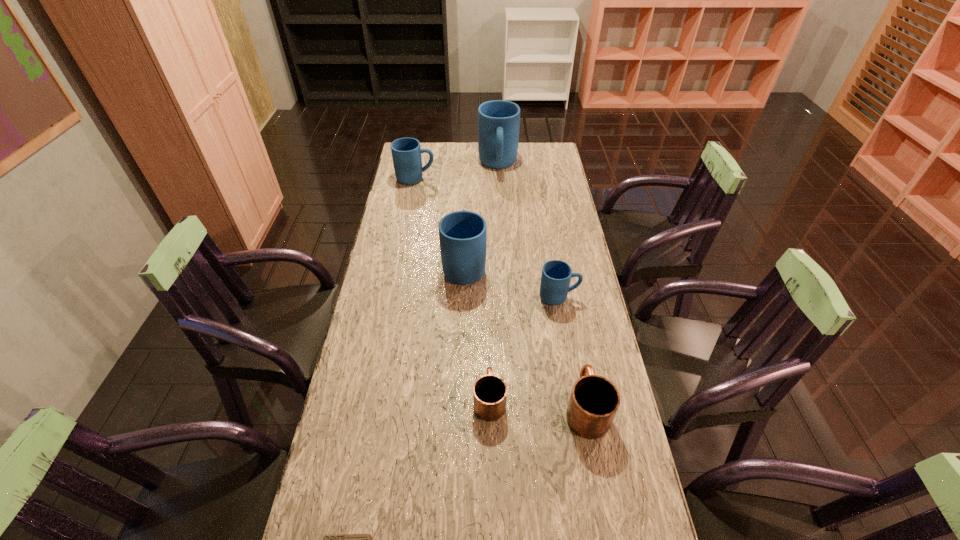
This screenshot has height=540, width=960. Find the location of `free point located 0.240m on the side of the left rust mug with the handle`. free point located 0.240m on the side of the left rust mug with the handle is located at coordinates (488, 314).

Locate an element on the screen. Image resolution: width=960 pixels, height=540 pixels. vacant region located 0.100m on the side of the left rust mug with the handle is located at coordinates (489, 349).

Find the location of `object located in the far edge section of the desktop`. object located in the far edge section of the desktop is located at coordinates coord(498,121).

The width and height of the screenshot is (960, 540). I want to click on object located in the left edge section of the desktop, so click(406, 152).

What are the coordinates of `free space at the far edge of the desktop` in the screenshot? It's located at (463, 144).

You are a GUI agent. You are given a task and a screenshot of the screen. Output one action in this format:
    pyautogui.click(x=<x>, y=<y>)
    Task: Click on the blank space at the left edge
    This screenshot has width=960, height=540.
    Given the screenshot: What is the action you would take?
    pyautogui.click(x=374, y=278)

Identify the location of blank space at the right edge of the desktop. (536, 180).

You are a GUI agent. You are given a task and a screenshot of the screen. Output one action in this format:
    pyautogui.click(x=<x>, y=<y>)
    Task: Click on the free region at the far right corner of the desktop
    
    Given the screenshot: What is the action you would take?
    pyautogui.click(x=542, y=152)

Locate an element on the screen. unoccupied position between the tallest mug and the left rust mug is located at coordinates (493, 282).

Where is `free space between the tallest mug and the sixth tallest object`? free space between the tallest mug and the sixth tallest object is located at coordinates (493, 282).